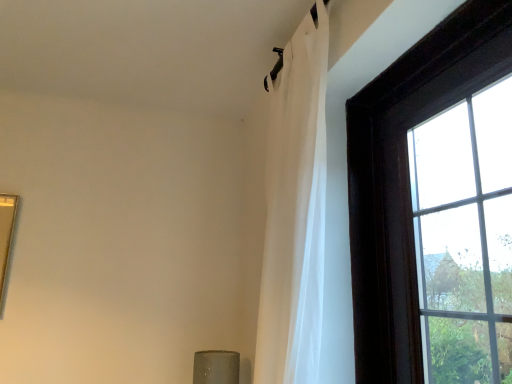
Question: From the image's perspective, is dark wood frame at upper right located above or below white sheer curtain at upper right?

Choices:
 (A) below
 (B) above

Answer: (A)

Question: Considering their positions, is dark wood frame at upper right located in front of or behind white sheer curtain at upper right?

Choices:
 (A) behind
 (B) front

Answer: (B)

Question: Is dark wood frame at upper right to the left or to the right of white sheer curtain at upper right in the image?

Choices:
 (A) right
 (B) left

Answer: (A)

Question: In the image, is white sheer curtain at upper right positioned in front of or behind dark wood frame at upper right?

Choices:
 (A) behind
 (B) front

Answer: (A)

Question: From the image's perspective, is white sheer curtain at upper right located above or below dark wood frame at upper right?

Choices:
 (A) above
 (B) below

Answer: (A)

Question: Looking at the image, does white sheer curtain at upper right seem bigger or smaller compared to dark wood frame at upper right?

Choices:
 (A) big
 (B) small

Answer: (A)

Question: From a real-world perspective, relative to dark wood frame at upper right, is white sheer curtain at upper right vertically above or below?

Choices:
 (A) above
 (B) below

Answer: (A)